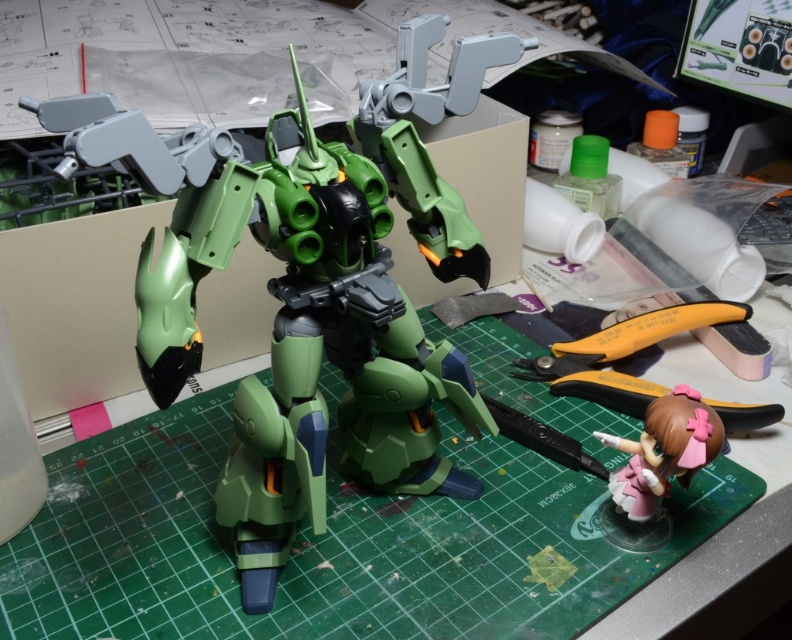
You are a modeler working on the mecha. You need to reach for the pink glossy figurine at lower right and the black plastic pliers at lower right. Which one is closer to your hand if your hand is currently positioned at the center of the green cutting mat?

The pink glossy figurine at lower right is 5.14 inches away from the black plastic pliers at lower right. Since both are at the lower right, the distance between them is 5.14 inches, but without knowing their exact positions relative to the center, we cannot determine which is closer to your hand. Please provide more information about their positions relative to the center.

You are a model builder who needs to place the pink glossy figurine at lower right on top of the green plastic robot at center. Given that the robot has a flat surface on its chest, will the figurine fit without falling off?

The distance between the green plastic robot at center and the pink glossy figurine at lower right is 32.24 centimeters. Since the figurine is placed on the robot, the distance is irrelevant as it will be secured on the chest surface.

What object is located at the coordinates point (315, 324)?

The green plastic robot at center is located at point (315, 324).